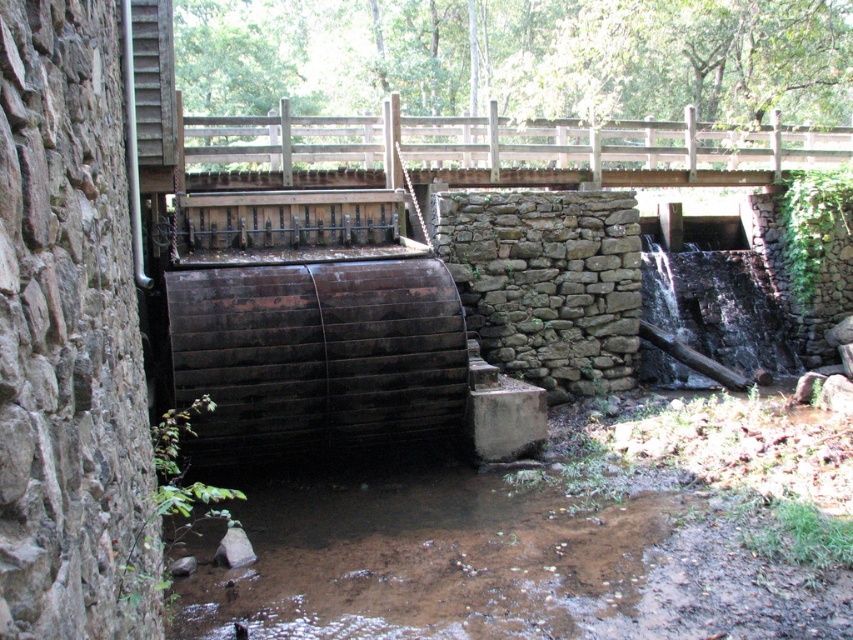
Question: Does brown muddy water at lower center appear over wooden bridge at upper center?

Choices:
 (A) no
 (B) yes

Answer: (A)

Question: Does brown muddy water at lower center have a greater width compared to wooden bridge at upper center?

Choices:
 (A) yes
 (B) no

Answer: (B)

Question: Which of the following is the closest to the observer?

Choices:
 (A) (312, 132)
 (B) (392, 608)

Answer: (B)

Question: Does brown muddy water at lower center appear under wooden bridge at upper center?

Choices:
 (A) yes
 (B) no

Answer: (A)